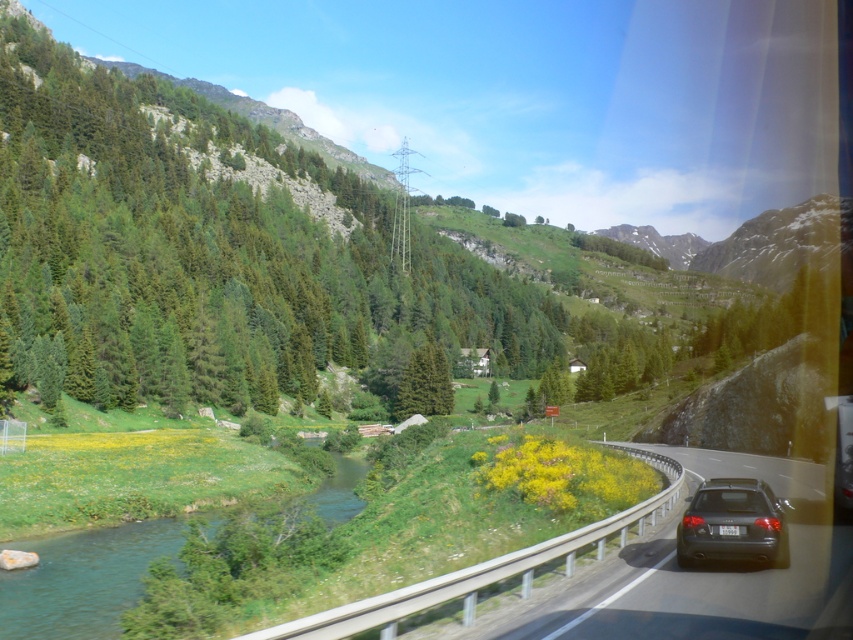
Can you confirm if green grassy river at lower left is positioned above green matte tree at center?

No.

Is green grassy river at lower left to the left of green matte tree at center from the viewer's perspective?

Indeed, green grassy river at lower left is positioned on the left side of green matte tree at center.

Who is more forward, (4, 609) or (433, 394)?

Positioned in front is point (4, 609).

Locate an element on the screen. This screenshot has height=640, width=853. green grassy river at lower left is located at coordinates (82, 579).

Consider the image. Measure the distance between black asphalt highway at center and camera.

The distance of black asphalt highway at center from camera is 4.86 meters.

Is black asphalt highway at center positioned before green matte tree at center?

Yes, it is in front of green matte tree at center.

Which is behind, point (639, 632) or point (424, 353)?

The point (424, 353) is more distant.

Where is `black asphalt highway at center`? The width and height of the screenshot is (853, 640). black asphalt highway at center is located at coordinates (701, 572).

Can you confirm if black asphalt highway at center is smaller than dark gray metallic car at lower right?

No.

Does black asphalt highway at center lie behind dark gray metallic car at lower right?

No, black asphalt highway at center is in front of dark gray metallic car at lower right.

Does point (378, 620) lie behind point (746, 550)?

No, (378, 620) is closer to viewer.

Where is `black asphalt highway at center`? The width and height of the screenshot is (853, 640). black asphalt highway at center is located at coordinates (701, 572).